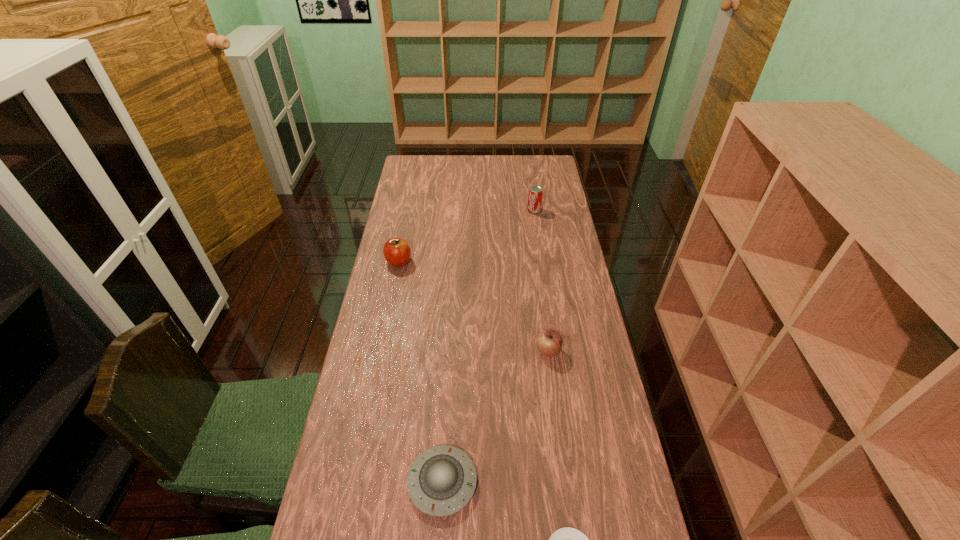
Identify the location of soda can. This screenshot has width=960, height=540. (535, 194).

At what (x,y) coordinates should I click in order to perform the action: click on the leftmost object. Please return your answer as a coordinate pair (x, y). The width and height of the screenshot is (960, 540). Looking at the image, I should click on (396, 251).

Locate an element on the screen. The image size is (960, 540). the left apple is located at coordinates (396, 251).

This screenshot has width=960, height=540. I want to click on the third nearest object, so click(549, 342).

Locate an element on the screen. This screenshot has width=960, height=540. the right apple is located at coordinates (549, 342).

Identify the location of the fourth farthest object. This screenshot has height=540, width=960. (442, 479).

Identify the location of the second object from left to right. (442, 479).

I want to click on vacant space located 0.150m on the front of the farthest object, so click(x=538, y=237).

Where is `blank area located on the front of the left apple`? blank area located on the front of the left apple is located at coordinates (384, 334).

Image resolution: width=960 pixels, height=540 pixels. Identify the location of vacant region located 0.060m on the front of the third farthest object. (552, 379).